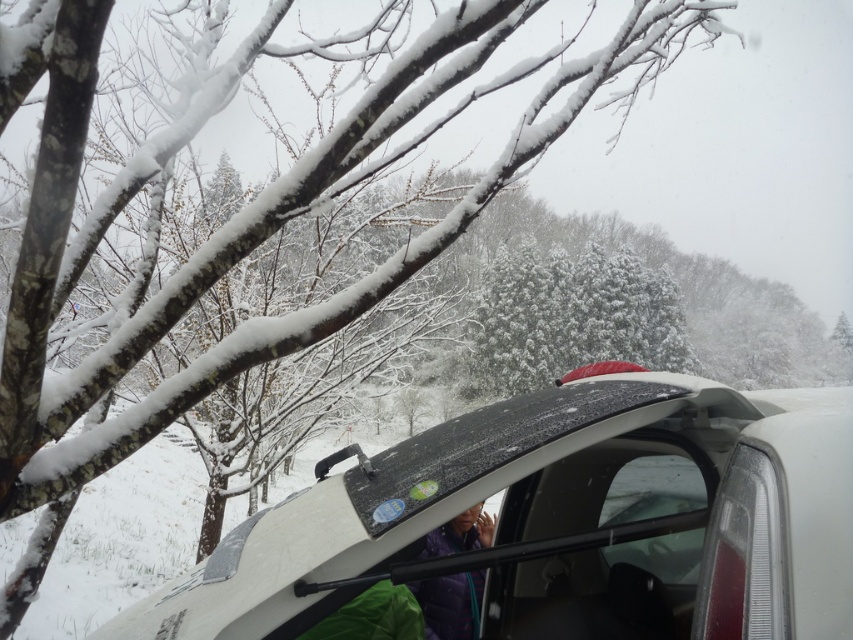
You are standing in the snowy scene and want to take a photo of both the white glossy car at lower right and the purple fabric at lower center. Which object should you focus on first to ensure both are in the frame?

You should focus on the white glossy car at lower right first since it is closer to the viewer than the purple fabric at lower center, allowing both to be in the frame by adjusting the camera angle accordingly.